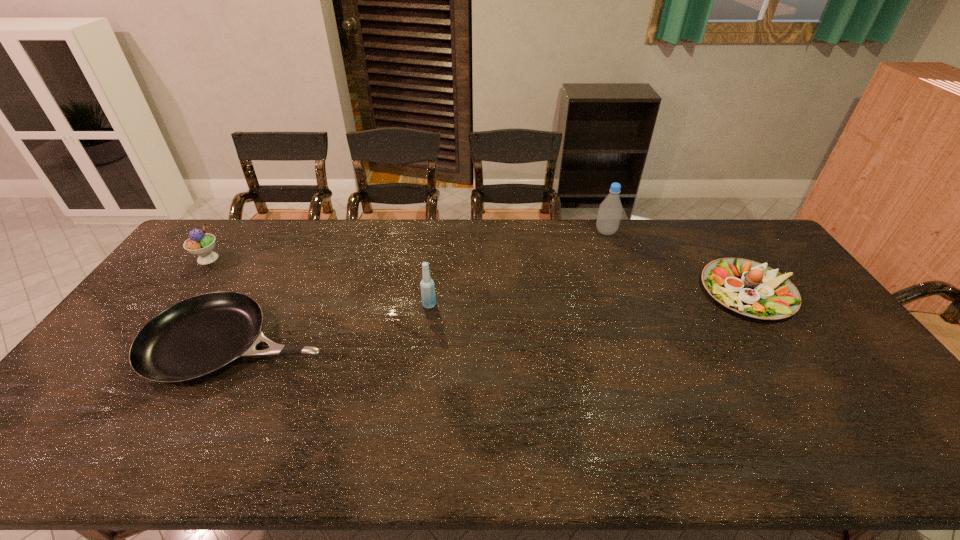
Identify the location of free location located on the front of the third shortest object. [168, 312].

Find the location of a particular element. The width and height of the screenshot is (960, 540). vacant space located 0.330m on the front of the salad plate is located at coordinates (841, 428).

Identify the location of free location located 0.220m on the right of the shortest object. Image resolution: width=960 pixels, height=540 pixels. (413, 342).

Where is `bottle that is at the far edge`? bottle that is at the far edge is located at coordinates (610, 210).

Image resolution: width=960 pixels, height=540 pixels. What are the coordinates of `icecream at the far edge` in the screenshot? It's located at (201, 244).

Locate an element on the screen. icecream present at the left edge is located at coordinates (201, 244).

The width and height of the screenshot is (960, 540). Find the location of `pan that is at the left edge`. pan that is at the left edge is located at coordinates (199, 336).

The image size is (960, 540). Identify the location of object that is at the right edge. (747, 287).

Locate an element on the screen. object at the far left corner is located at coordinates (201, 244).

Where is `blank area at the far edge`? Image resolution: width=960 pixels, height=540 pixels. blank area at the far edge is located at coordinates (686, 253).